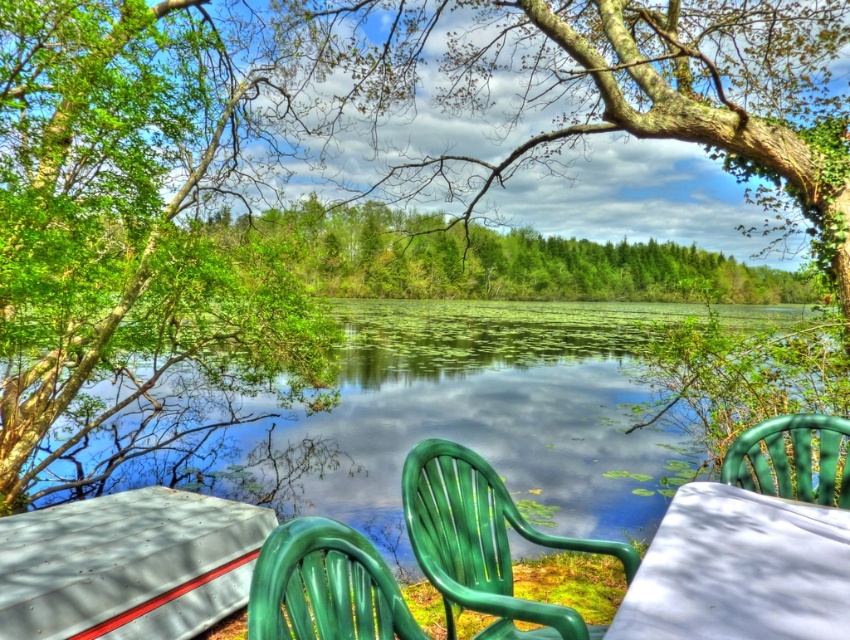
Question: Observing the image, what is the correct spatial positioning of white matte table at lower left in reference to green plastic chair at right?

Choices:
 (A) left
 (B) right

Answer: (A)

Question: Which of the following is the farthest from the observer?

Choices:
 (A) (598, 257)
 (B) (473, 468)
 (C) (837, 525)
 (D) (415, 358)

Answer: (D)

Question: Is white matte table at lower left closer to camera compared to white glossy table at lower right?

Choices:
 (A) no
 (B) yes

Answer: (A)

Question: Does green leafy tree at center appear over white glossy table at lower right?

Choices:
 (A) yes
 (B) no

Answer: (A)

Question: Which of these objects is positioned closest to the green leafy tree at center?

Choices:
 (A) green plastic chair at lower center
 (B) transparent water at center
 (C) white matte table at lower left
 (D) white glossy table at lower right

Answer: (B)

Question: Which object is the closest to the white glossy table at lower right?

Choices:
 (A) white matte table at lower left
 (B) green plastic chair at lower center
 (C) green leafy tree at center

Answer: (B)